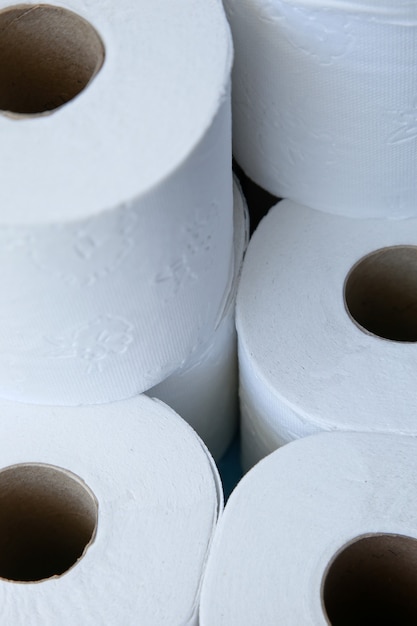
At what (x,y) coordinates should I click in order to perform the action: click on toilet paper roll. Please return your answer as a coordinate pair (x, y). The height and width of the screenshot is (626, 417). Looking at the image, I should click on pyautogui.click(x=161, y=480), pyautogui.click(x=296, y=506), pyautogui.click(x=322, y=385), pyautogui.click(x=204, y=377), pyautogui.click(x=138, y=195), pyautogui.click(x=338, y=99).